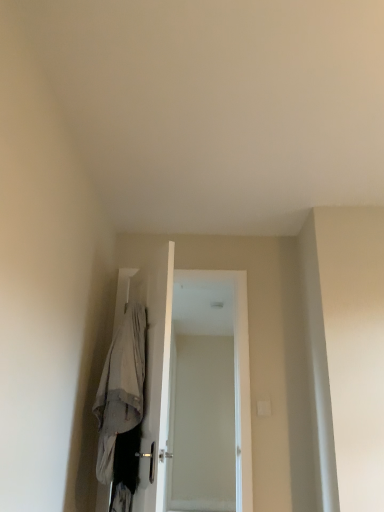
Question: In the image, is light gray fabric robe at center positioned in front of or behind white glossy screen door at center?

Choices:
 (A) front
 (B) behind

Answer: (A)

Question: From a real-world perspective, is light gray fabric robe at center physically located above or below white glossy screen door at center?

Choices:
 (A) above
 (B) below

Answer: (B)

Question: Considering the positions of point (132, 404) and point (248, 501), is point (132, 404) closer or farther from the camera than point (248, 501)?

Choices:
 (A) closer
 (B) farther

Answer: (A)

Question: Is white glossy screen door at center spatially inside light gray fabric robe at center, or outside of it?

Choices:
 (A) inside
 (B) outside

Answer: (B)

Question: Considering the positions of white glossy screen door at center and light gray fabric robe at center in the image, is white glossy screen door at center taller or shorter than light gray fabric robe at center?

Choices:
 (A) tall
 (B) short

Answer: (A)

Question: From the image's perspective, is white glossy screen door at center positioned above or below light gray fabric robe at center?

Choices:
 (A) below
 (B) above

Answer: (A)

Question: Does point (241, 313) appear closer or farther from the camera than point (107, 362)?

Choices:
 (A) closer
 (B) farther

Answer: (B)